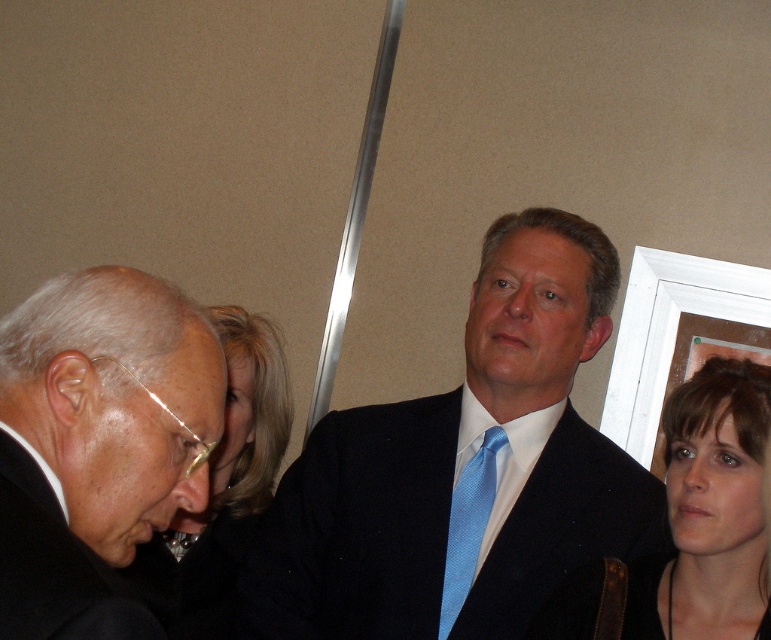
Question: Which point appears farthest from the camera in this image?

Choices:
 (A) (39, 593)
 (B) (17, 483)
 (C) (273, 369)
 (D) (677, 493)

Answer: (C)

Question: Can you confirm if matte black suit at center is positioned above brown hair at upper right?

Choices:
 (A) yes
 (B) no

Answer: (A)

Question: Is matte black suit at left positioned at the back of black matte suit at lower left?

Choices:
 (A) yes
 (B) no

Answer: (B)

Question: Which is farther from the dark brown hair at center?

Choices:
 (A) black matte suit at lower left
 (B) matte black suit at center
 (C) brown hair at upper right

Answer: (A)

Question: Is brown hair at upper right to the right of black matte suit at lower left from the viewer's perspective?

Choices:
 (A) no
 (B) yes

Answer: (B)

Question: Which of the following is the closest to the observer?

Choices:
 (A) (724, 308)
 (B) (76, 557)
 (C) (254, 410)
 (D) (734, 572)

Answer: (B)